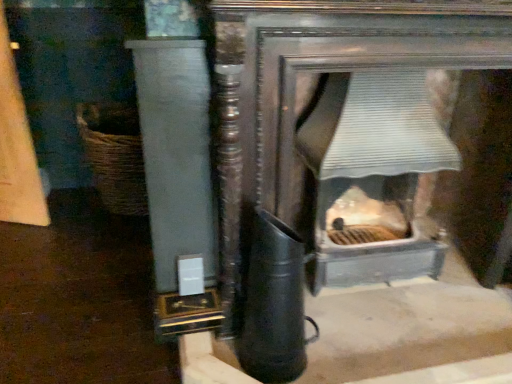
Question: Is woven brown basket at left taller than white glossy pillar at left?

Choices:
 (A) no
 (B) yes

Answer: (A)

Question: Is woven brown basket at left positioned far away from white glossy pillar at left?

Choices:
 (A) no
 (B) yes

Answer: (B)

Question: Considering the relative sizes of woven brown basket at left and white glossy pillar at left in the image provided, is woven brown basket at left thinner than white glossy pillar at left?

Choices:
 (A) no
 (B) yes

Answer: (A)

Question: Is woven brown basket at left not within white glossy pillar at left?

Choices:
 (A) no
 (B) yes

Answer: (B)

Question: Considering the relative sizes of woven brown basket at left and white glossy pillar at left in the image provided, is woven brown basket at left shorter than white glossy pillar at left?

Choices:
 (A) no
 (B) yes

Answer: (B)

Question: Looking at the image, does woven brown basket at left seem bigger or smaller compared to metallic gray fireplace at center?

Choices:
 (A) big
 (B) small

Answer: (B)

Question: In terms of height, does woven brown basket at left look taller or shorter compared to metallic gray fireplace at center?

Choices:
 (A) short
 (B) tall

Answer: (A)

Question: From the image's perspective, relative to metallic gray fireplace at center, is woven brown basket at left above or below?

Choices:
 (A) below
 (B) above

Answer: (B)

Question: Looking at their shapes, would you say woven brown basket at left is wider or thinner than metallic gray fireplace at center?

Choices:
 (A) thin
 (B) wide

Answer: (B)

Question: From a real-world perspective, is metallic gray fireplace at center above or below white glossy pillar at left?

Choices:
 (A) below
 (B) above

Answer: (A)

Question: Considering their positions, is metallic gray fireplace at center located in front of or behind white glossy pillar at left?

Choices:
 (A) front
 (B) behind

Answer: (B)

Question: Does point (327, 274) appear closer or farther from the camera than point (156, 180)?

Choices:
 (A) closer
 (B) farther

Answer: (B)

Question: Considering the relative positions of metallic gray fireplace at center and white glossy pillar at left in the image provided, is metallic gray fireplace at center to the left or to the right of white glossy pillar at left?

Choices:
 (A) left
 (B) right

Answer: (B)

Question: Considering their positions, is white glossy pillar at left located in front of or behind metallic gray fireplace at center?

Choices:
 (A) behind
 (B) front

Answer: (B)

Question: Is white glossy pillar at left taller or shorter than metallic gray fireplace at center?

Choices:
 (A) tall
 (B) short

Answer: (A)